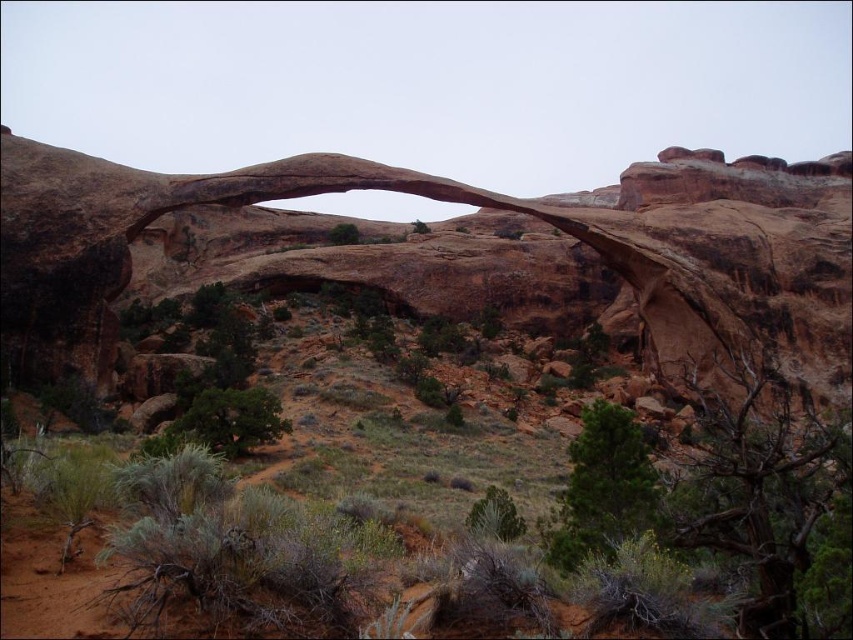
You are a hiker standing at the point marked by point [468,204] in the image. What is the name of the geological feature you are currently standing under?

The point [468,204] marks the rustic sandstone arch at center, so you are standing under the rustic sandstone arch at center.

You are a hiker trying to navigate through the desert. You see the rustic sandstone arch at center and the green leafy bush at lower left. Which object is located higher in the image?

The rustic sandstone arch at center is positioned over the green leafy bush at lower left, so the rustic sandstone arch at center is higher in the image.